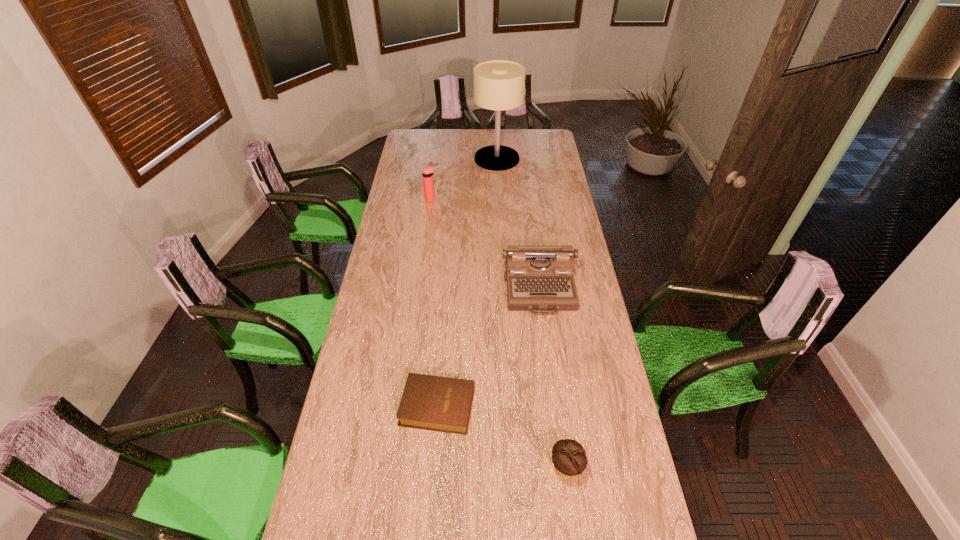
At what (x,y) coordinates should I click in order to perform the action: click on free spot at the right edge of the desktop. Please return your answer as a coordinate pair (x, y). This screenshot has width=960, height=540. Looking at the image, I should click on (563, 183).

The width and height of the screenshot is (960, 540). Identify the location of vacant space that is in between the third shortest object and the fourth nearest object. (485, 245).

Where is `free space between the shortest object and the table lamp`? This screenshot has height=540, width=960. free space between the shortest object and the table lamp is located at coordinates (468, 282).

This screenshot has height=540, width=960. I want to click on blank region between the farthest object and the muffin, so click(x=532, y=313).

In order to click on free space between the fourth farthest object and the farthest object in this screenshot , I will do `click(468, 282)`.

At what (x,y) coordinates should I click in order to perform the action: click on vacant area that lies between the muffin and the fourth farthest object. Please return your answer as a coordinate pair (x, y). The image size is (960, 540). Looking at the image, I should click on (502, 437).

Locate an element on the screen. free space between the thermos bottle and the third nearest object is located at coordinates point(485,245).

Where is `free space between the thermos bottle and the fourth farthest object`? Image resolution: width=960 pixels, height=540 pixels. free space between the thermos bottle and the fourth farthest object is located at coordinates (434, 303).

I want to click on free spot between the Bible and the table lamp, so click(468, 282).

Image resolution: width=960 pixels, height=540 pixels. What are the coordinates of `object that ranks as the closest to the third shortest object` in the screenshot? It's located at (443, 404).